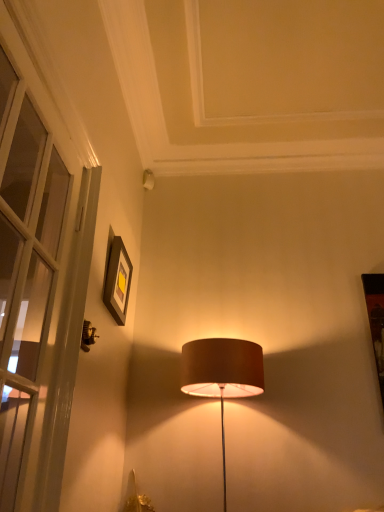
Question: Is white glass door at left oriented towards matte black picture frame at upper left?

Choices:
 (A) yes
 (B) no

Answer: (B)

Question: Is white glass door at left with matte black picture frame at upper left?

Choices:
 (A) yes
 (B) no

Answer: (B)

Question: Does white glass door at left appear on the right side of matte black picture frame at upper left?

Choices:
 (A) yes
 (B) no

Answer: (B)

Question: Does white glass door at left appear on the left side of matte black picture frame at upper left?

Choices:
 (A) yes
 (B) no

Answer: (A)

Question: Is white glass door at left bigger than matte black picture frame at upper left?

Choices:
 (A) no
 (B) yes

Answer: (B)

Question: Considering the relative sizes of white glass door at left and matte black picture frame at upper left in the image provided, is white glass door at left wider than matte black picture frame at upper left?

Choices:
 (A) yes
 (B) no

Answer: (A)

Question: Is matte black picture frame at upper left wider than white glass door at left?

Choices:
 (A) no
 (B) yes

Answer: (A)

Question: Does matte black picture frame at upper left appear on the right side of white glass door at left?

Choices:
 (A) yes
 (B) no

Answer: (A)

Question: Is matte black picture frame at upper left smaller than white glass door at left?

Choices:
 (A) no
 (B) yes

Answer: (B)

Question: Is white glass door at left at the back of matte black picture frame at upper left?

Choices:
 (A) no
 (B) yes

Answer: (A)

Question: From the image's perspective, does matte black picture frame at upper left appear lower than white glass door at left?

Choices:
 (A) yes
 (B) no

Answer: (A)

Question: From the image's perspective, is matte black picture frame at upper left over white glass door at left?

Choices:
 (A) yes
 (B) no

Answer: (B)

Question: Is matte black picture frame at upper left in front of or behind white glass door at left in the image?

Choices:
 (A) behind
 (B) front

Answer: (A)